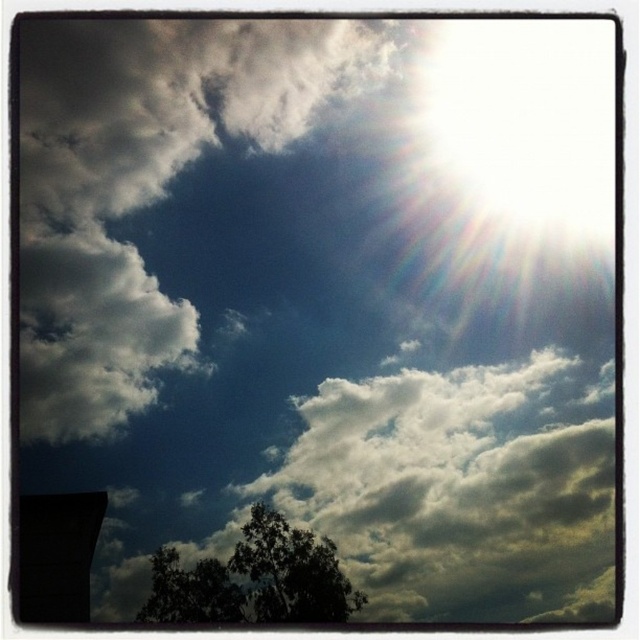
You are an astronomer analyzing the celestial positions in the image. The sun is at upper right corner. Where is the white fluffy cloud at upper left located relative to the sun?

The white fluffy cloud at upper left is located at point 0.286 on the x axis and 0.233 on the y axis, which is to the left and lower than the sun at upper right corner.

You are an astronomer analyzing this sky image. You need to locate the white fluffy cloud at center. What are its coordinates?

The white fluffy cloud at center is located at coordinates point (449, 486).

You are an airplane pilot flying at a high altitude. You notice the white fluffy cloud at upper left and the dark green leafy tree at lower left from your cockpit window. Which object is wider in your view?

The white fluffy cloud at upper left might be wider than dark green leafy tree at lower left, so it appears wider in your view.